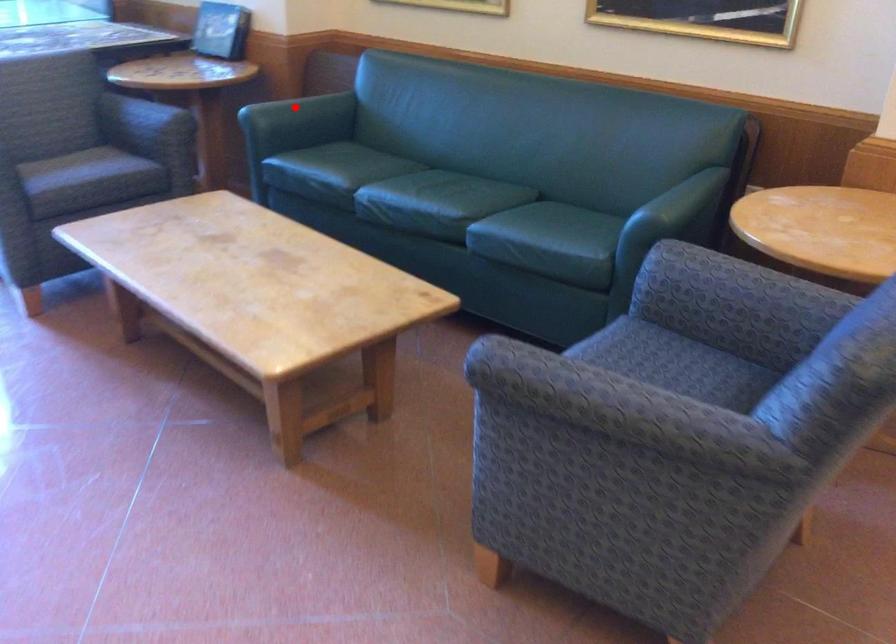
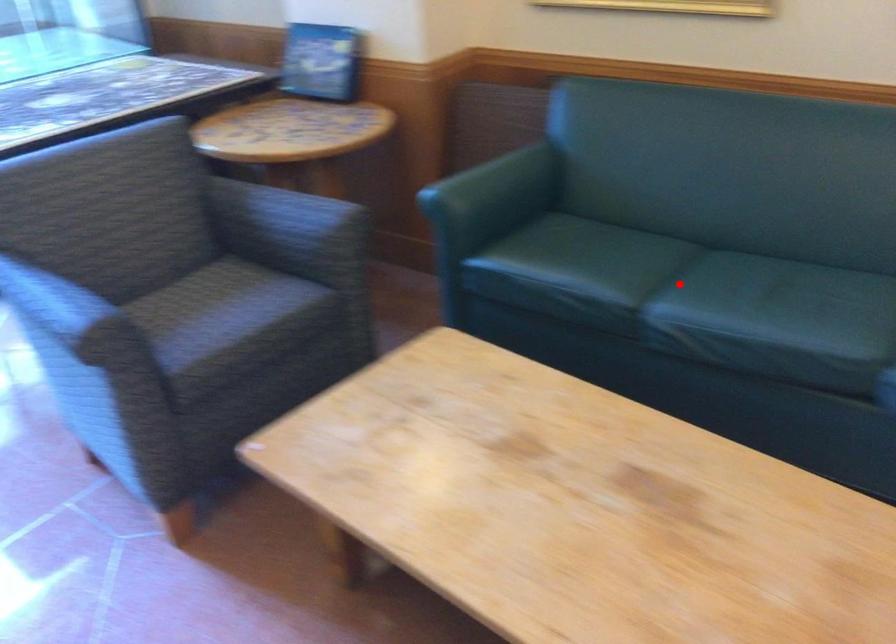
I am providing you with two images of the same scene from different viewpoints. A red point is marked on the first image and another point is marked on the second image. Does the point marked in image1 correspond to the same location as the one in image2?

No